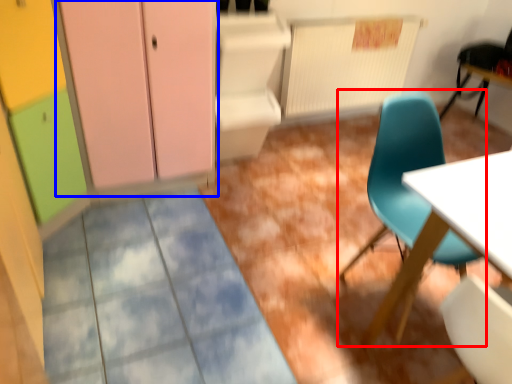
Question: Which point is further to the camera, chair (highlighted by a red box) or dresser (highlighted by a blue box)?

Choices:
 (A) chair
 (B) dresser

Answer: (B)